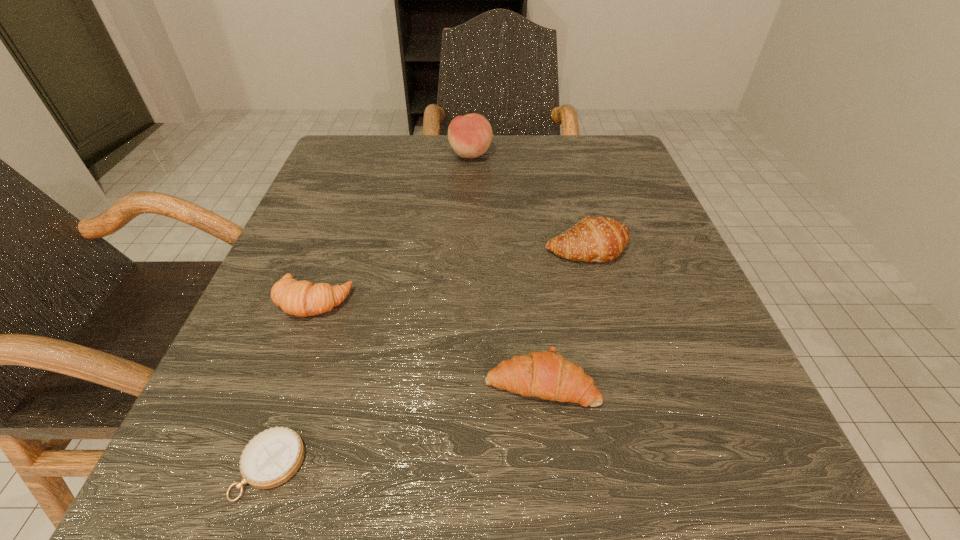
The height and width of the screenshot is (540, 960). I want to click on the farthest object, so (x=470, y=136).

This screenshot has width=960, height=540. Identify the location of the tallest object. (470, 136).

You are a GUI agent. You are given a task and a screenshot of the screen. Output one action in this format:
    pyautogui.click(x=<x>, y=<y>)
    Task: Click on the second farthest object
    
    Given the screenshot: What is the action you would take?
    pyautogui.click(x=600, y=239)

Where is `the tallest crescent roll`? The image size is (960, 540). the tallest crescent roll is located at coordinates (600, 239).

The image size is (960, 540). In order to click on the second nearest crescent roll in this screenshot , I will do `click(303, 298)`.

Identify the location of the third nearest object. The image size is (960, 540). (303, 298).

Where is `the second nearest object`? Image resolution: width=960 pixels, height=540 pixels. the second nearest object is located at coordinates (544, 374).

Locate an element on the screen. This screenshot has width=960, height=540. the nearest object is located at coordinates (272, 457).

Where is `the shortest object`? The image size is (960, 540). the shortest object is located at coordinates coord(272,457).

Identify the location of vacant space positioned on the front of the farthest object. This screenshot has width=960, height=540. (468, 228).